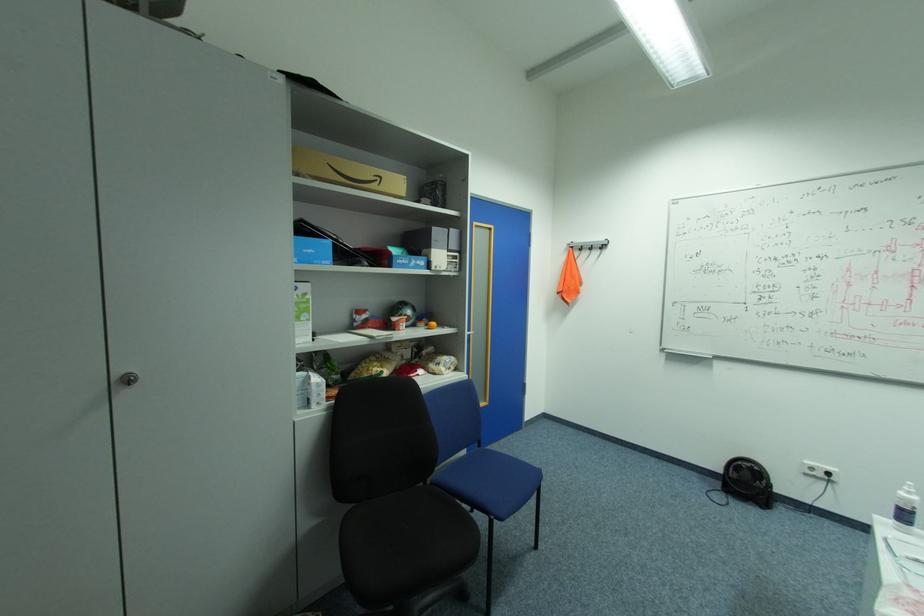
Find the location of a particular element. This screenshot has width=924, height=616. small orange ball is located at coordinates (431, 325).